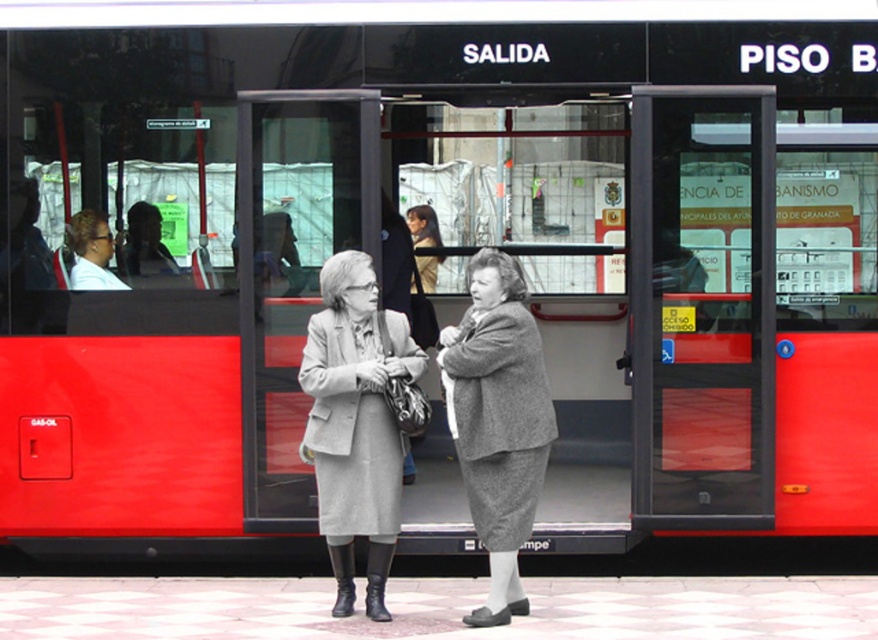
Question: Does gray wool coat at center have a lesser width compared to gray woolen suit at center?

Choices:
 (A) no
 (B) yes

Answer: (A)

Question: Observing the image, what is the correct spatial positioning of gray wool coat at center in reference to gray woolen suit at center?

Choices:
 (A) above
 (B) below

Answer: (B)

Question: Among these points, which one is farthest from the camera?

Choices:
 (A) (373, 432)
 (B) (512, 321)

Answer: (A)

Question: Does gray wool coat at center lie in front of gray woolen suit at center?

Choices:
 (A) yes
 (B) no

Answer: (B)